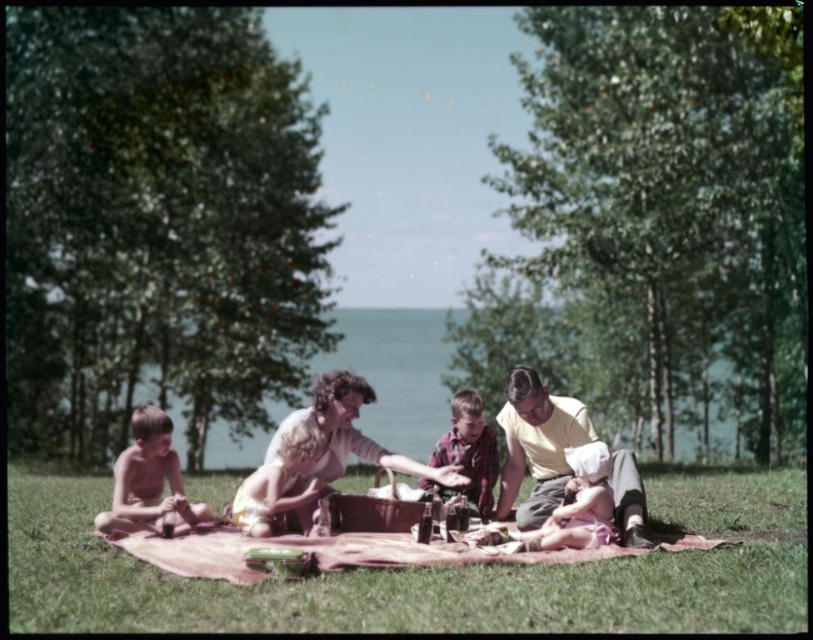
Does light brown fabric diaper at center lie in front of plaid fabric shirt at center?

That is True.

Can you confirm if light brown fabric diaper at center is wider than plaid fabric shirt at center?

Correct, the width of light brown fabric diaper at center exceeds that of plaid fabric shirt at center.

The width and height of the screenshot is (813, 640). Identify the location of light brown fabric diaper at center. (280, 481).

Measure the distance between yellow cotton shirt at center and camera.

7.64 meters

Measure the distance between yellow cotton shirt at center and blond hair boy at lower left.

A distance of 8.38 feet exists between yellow cotton shirt at center and blond hair boy at lower left.

Is point (618, 460) farther from viewer compared to point (146, 440)?

No, (618, 460) is in front of (146, 440).

Identify the location of yellow cotton shirt at center. (538, 445).

Is point (451, 476) more distant than point (290, 509)?

Yes.

At what (x,y) coordinates should I click in order to perform the action: click on matte yellow shirt at center. Please return your answer as a coordinate pair (x, y). Looking at the image, I should click on (346, 436).

Who is more forward, (338, 408) or (279, 476)?

Point (279, 476) is more forward.

Where is `matte yellow shirt at center`? The image size is (813, 640). matte yellow shirt at center is located at coordinates (346, 436).